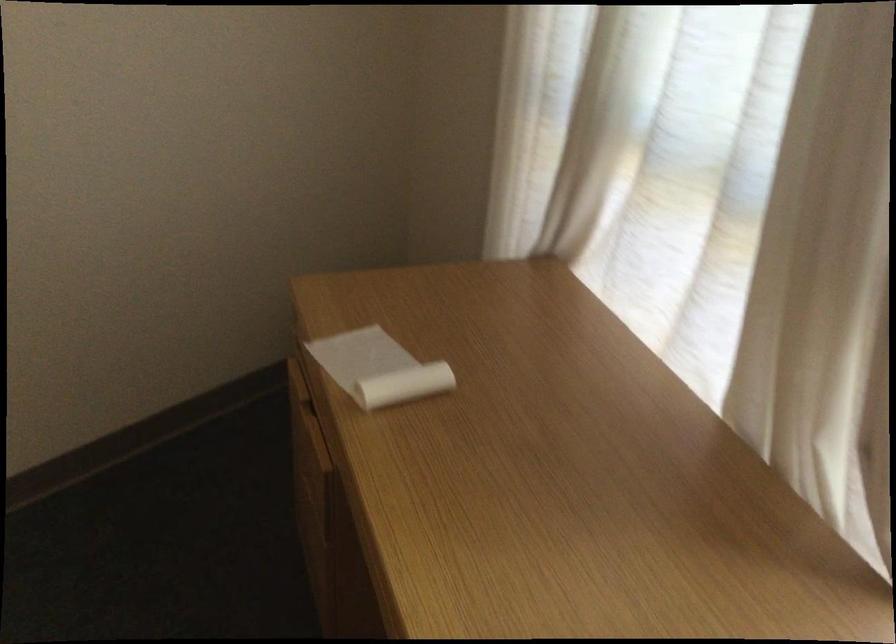
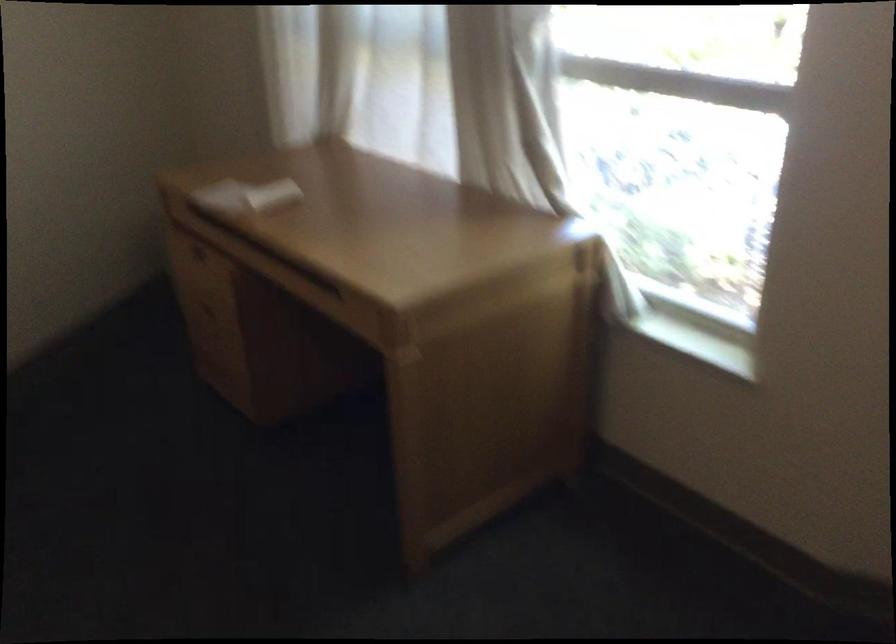
Find the pixel in the second image that matches pixel 375 339 in the first image.

(234, 191)